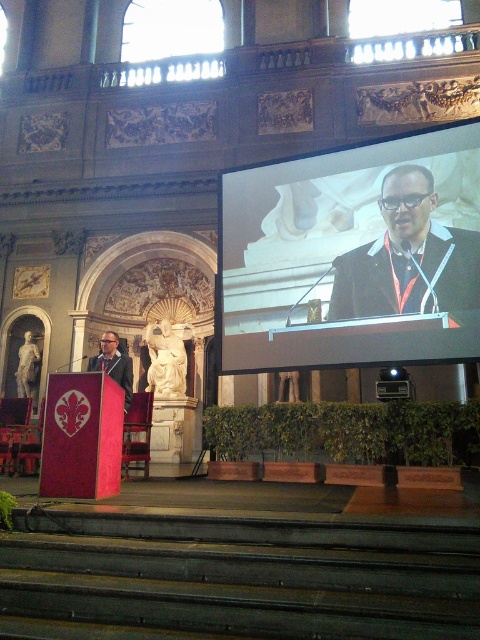
Question: Which object is farther from the camera taking this photo?

Choices:
 (A) matte black podium at left
 (B) black matte suit at upper center

Answer: (A)

Question: Which point is closer to the camera taking this photo?

Choices:
 (A) (405, 228)
 (B) (408, 273)

Answer: (B)

Question: Can you confirm if matte black screen at upper center is smaller than matte black podium at left?

Choices:
 (A) no
 (B) yes

Answer: (A)

Question: Does matte black screen at upper center have a smaller size compared to matte black podium at left?

Choices:
 (A) yes
 (B) no

Answer: (B)

Question: Which object appears closest to the camera in this image?

Choices:
 (A) matte black podium at left
 (B) matte black screen at upper center
 (C) black matte suit at upper center

Answer: (B)

Question: Is matte black screen at upper center below black matte suit at upper center?

Choices:
 (A) yes
 (B) no

Answer: (B)